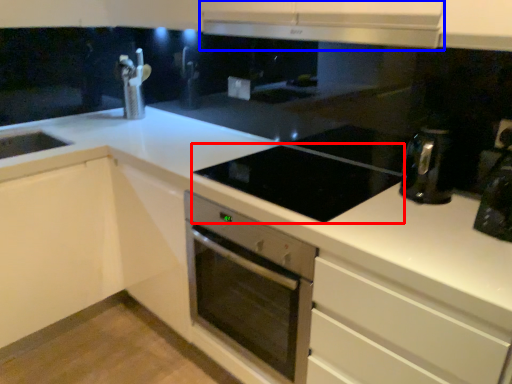
Question: Which object is further to the camera taking this photo, gas stove (highlighted by a red box) or exhaust hood (highlighted by a blue box)?

Choices:
 (A) gas stove
 (B) exhaust hood

Answer: (A)